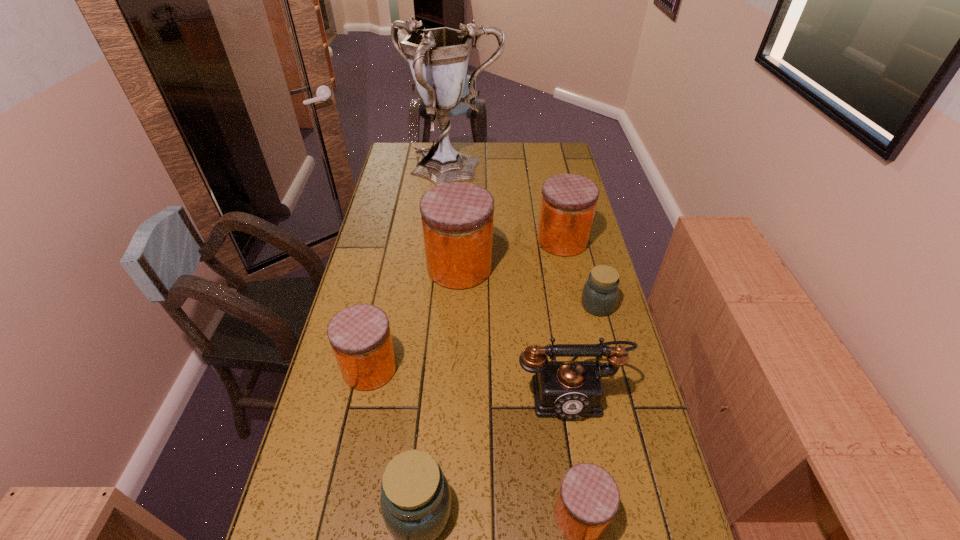
This screenshot has width=960, height=540. I want to click on free spot located 0.350m on the front of the gray trophy cup, so click(x=444, y=254).

The height and width of the screenshot is (540, 960). In order to click on vacant point located 0.240m on the front of the third orange jar from right to left in this screenshot , I will do `click(456, 351)`.

You are a GUI agent. You are given a task and a screenshot of the screen. Output one action in this format:
    pyautogui.click(x=<x>, y=<y>)
    Task: Click on the free space located 0.340m on the back of the fifth shortest jar
    This screenshot has height=540, width=960.
    Given the screenshot: What is the action you would take?
    click(549, 177)

Locate an element on the screen. vacant area situated 0.060m on the front of the gray telephone at the rotary dial is located at coordinates (578, 446).

At what (x,y) coordinates should I click in order to perform the action: click on free spot located on the back of the leftmost orange jar. Please return your answer as a coordinate pair (x, y). The width and height of the screenshot is (960, 540). Looking at the image, I should click on (392, 264).

This screenshot has width=960, height=540. Identify the location of vacant point located on the back of the fourth farthest object. (580, 236).

Where is `object that is at the far edge`? This screenshot has width=960, height=540. object that is at the far edge is located at coordinates (438, 58).

You are a GUI agent. You are given a task and a screenshot of the screen. Output one action in this format:
    pyautogui.click(x=<x>, y=<y>)
    Task: Click on the trophy cup that is at the left edge
    
    Given the screenshot: What is the action you would take?
    pyautogui.click(x=438, y=58)

Find the location of a particular element. The image size is (960, 540). jar at the left edge is located at coordinates (360, 336).

Where is `telephone that is at the right edge`? The image size is (960, 540). telephone that is at the right edge is located at coordinates (567, 389).